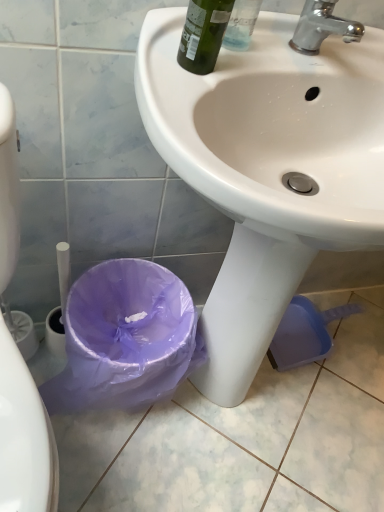
What are the coordinates of `vacant space that's between purple plastic bag at lower left and white glossy sink at center` in the screenshot? It's located at (108, 450).